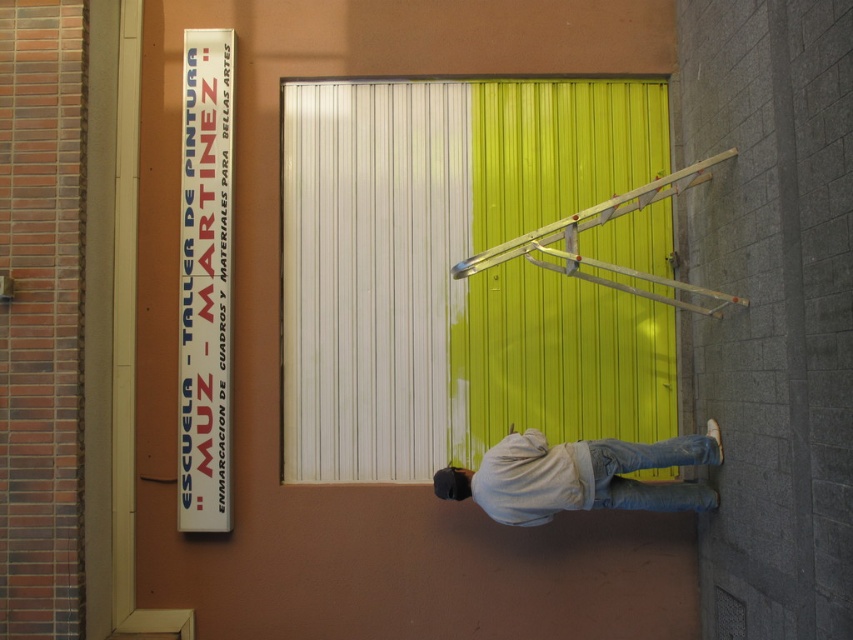
Question: Which of the following is the farthest from the observer?

Choices:
 (A) metallic silver ladder at center
 (B) light gray cotton shirt at lower right

Answer: (B)

Question: Does metallic silver ladder at center appear under jeans at lower right?

Choices:
 (A) yes
 (B) no

Answer: (B)

Question: Which point is closer to the camera?

Choices:
 (A) jeans at lower right
 (B) light gray cotton shirt at lower right
 (C) metallic silver ladder at center

Answer: (C)

Question: Among these points, which one is nearest to the camera?

Choices:
 (A) (706, 172)
 (B) (604, 483)

Answer: (B)

Question: Is metallic silver ladder at center below jeans at lower right?

Choices:
 (A) yes
 (B) no

Answer: (B)

Question: Can you confirm if light gray cotton shirt at lower right is thinner than jeans at lower right?

Choices:
 (A) yes
 (B) no

Answer: (B)